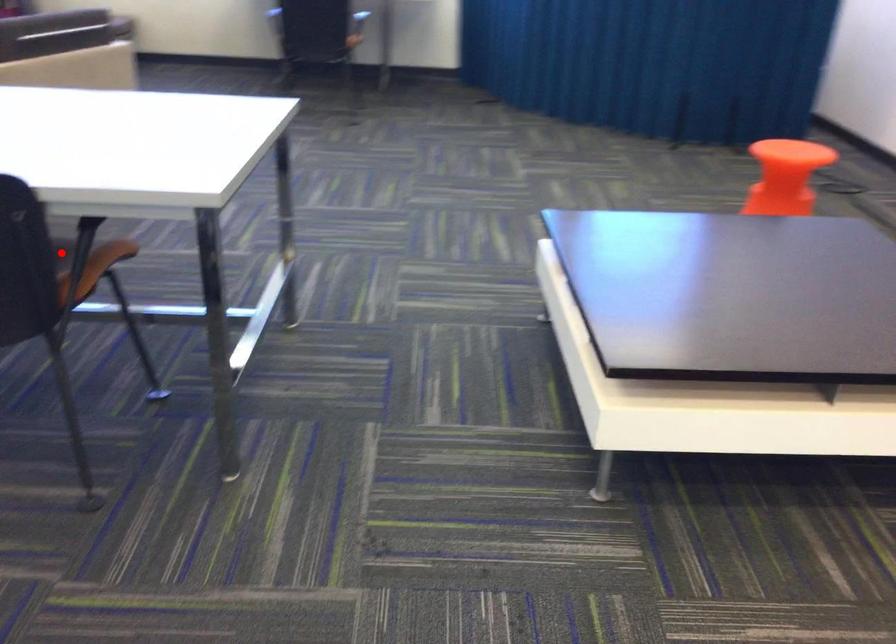
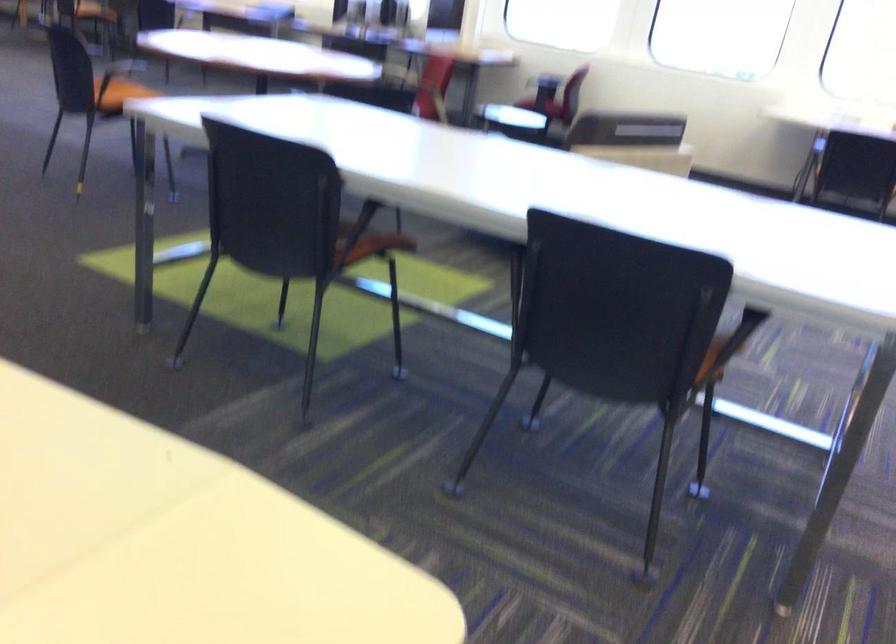
Question: I am providing you with two images of the same scene from different viewpoints. A red point is marked on the first image. Can you still see the location of the red point in image 2?

Choices:
 (A) Yes
 (B) No

Answer: (B)